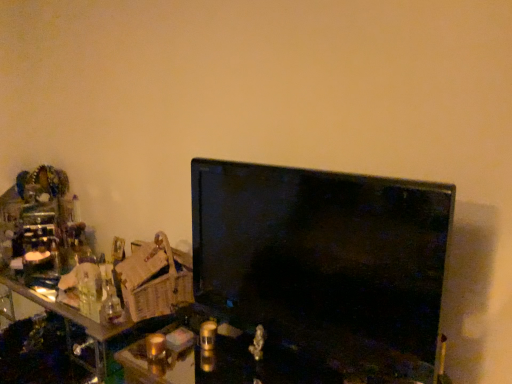
Question: Is matte black monitor at center in front of or behind black glossy tv at center in the image?

Choices:
 (A) front
 (B) behind

Answer: (A)

Question: Considering the positions of matte black monitor at center and black glossy tv at center in the image, is matte black monitor at center bigger or smaller than black glossy tv at center?

Choices:
 (A) big
 (B) small

Answer: (A)

Question: Is point (159, 382) closer or farther from the camera than point (211, 266)?

Choices:
 (A) farther
 (B) closer

Answer: (B)

Question: From the image's perspective, is black glossy tv at center located above or below matte black monitor at center?

Choices:
 (A) above
 (B) below

Answer: (A)

Question: Considering the positions of black glossy tv at center and matte black monitor at center in the image, is black glossy tv at center wider or thinner than matte black monitor at center?

Choices:
 (A) thin
 (B) wide

Answer: (A)

Question: Visually, is black glossy tv at center positioned to the left or to the right of matte black monitor at center?

Choices:
 (A) right
 (B) left

Answer: (A)

Question: Considering the positions of black glossy tv at center and matte black monitor at center in the image, is black glossy tv at center taller or shorter than matte black monitor at center?

Choices:
 (A) tall
 (B) short

Answer: (A)